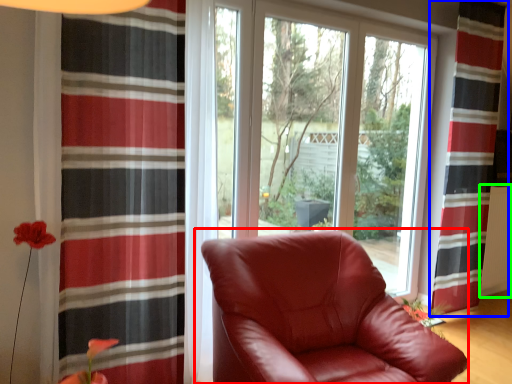
Question: Based on their relative distances, which object is nearer to chair (highlighted by a red box)? Choose from curtain (highlighted by a blue box) and radiator (highlighted by a green box).

Choices:
 (A) curtain
 (B) radiator

Answer: (A)